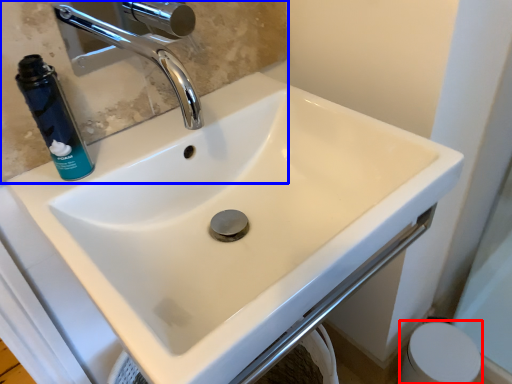
Question: Which object appears farthest to the camera in this image, toilet paper (highlighted by a red box) or mirror (highlighted by a blue box)?

Choices:
 (A) toilet paper
 (B) mirror

Answer: (A)